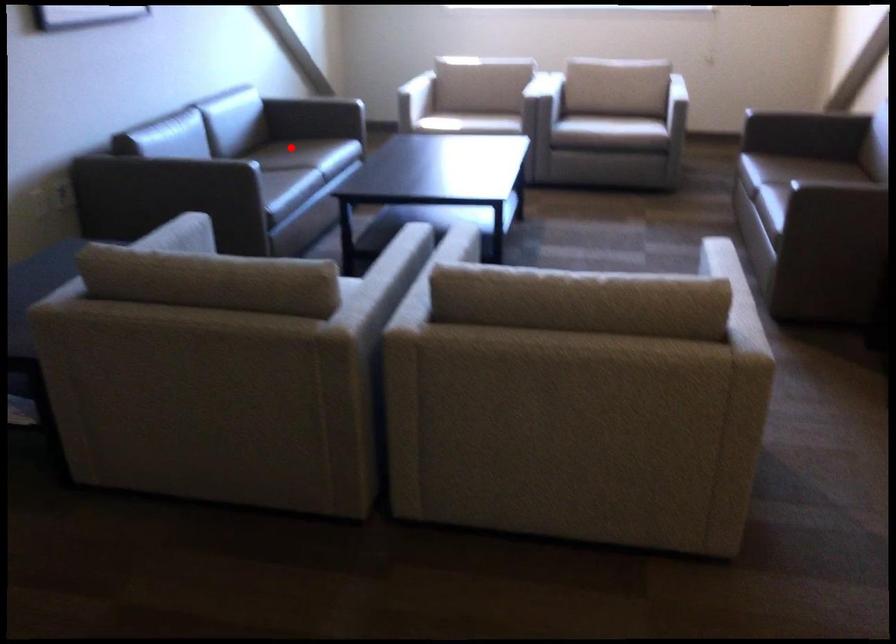
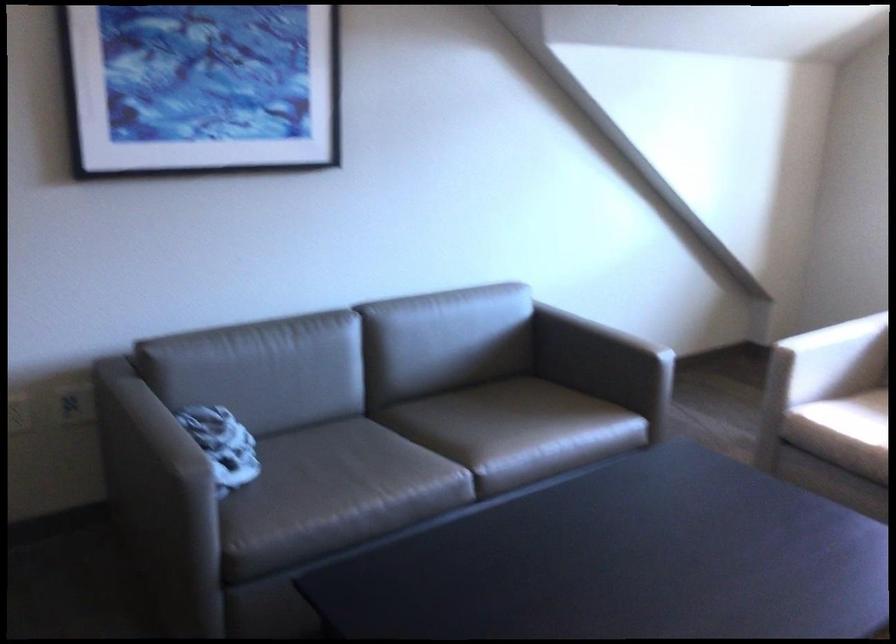
Question: I am providing you with two images of the same scene from different viewpoints. In image1, a red point is highlighted. Considering the same 3D point in image2, which of the following is correct?

Choices:
 (A) It is closer
 (B) It is farther

Answer: (A)